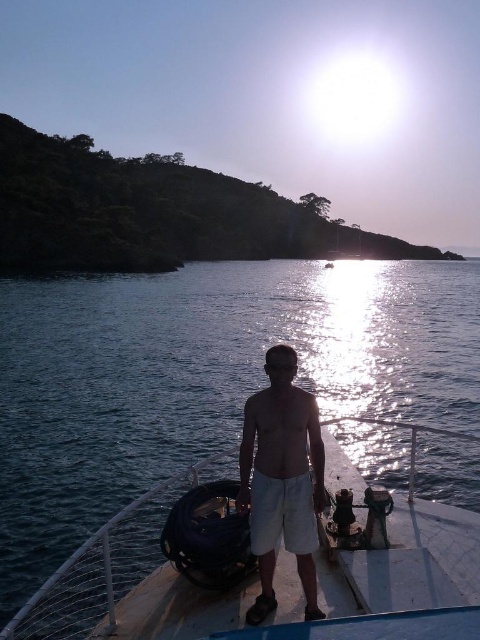
Is point (108, 515) positioned in front of point (289, 358)?

No, (108, 515) is further to viewer.

From the picture: Does blue water at center have a lesser height compared to white cotton shorts at center?

No, blue water at center is not shorter than white cotton shorts at center.

Does point (12, 580) come closer to viewer compared to point (283, 461)?

No, it is not.

The image size is (480, 640). In order to click on blue water at center in this screenshot , I will do `click(203, 378)`.